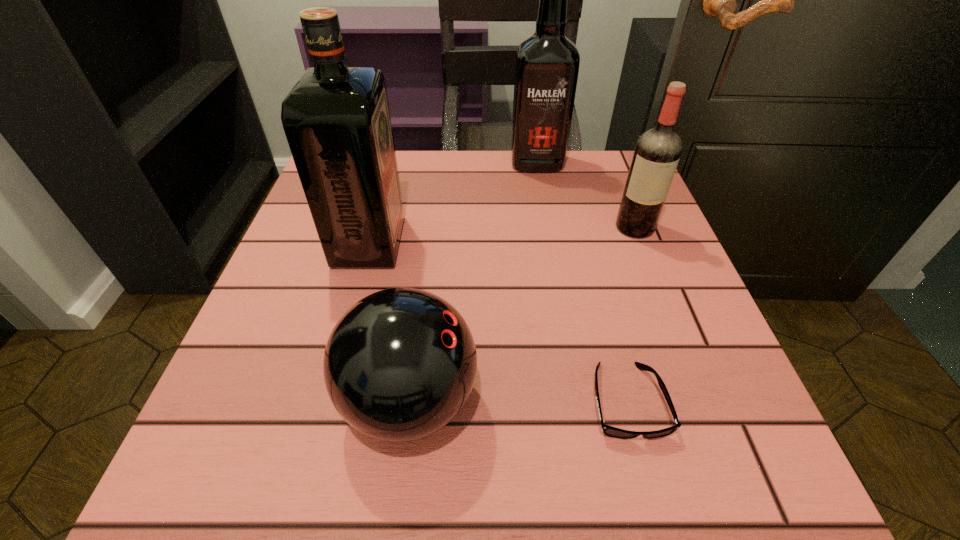
I want to click on blank space at the left edge of the desktop, so click(306, 271).

In the image, there is a desktop. At what (x,y) coordinates should I click in order to perform the action: click on vacant space at the right edge. Please return your answer as a coordinate pair (x, y). The image size is (960, 540). Looking at the image, I should click on (691, 334).

Find the location of `free space at the far right corner`. free space at the far right corner is located at coordinates (598, 200).

Locate an element on the screen. The width and height of the screenshot is (960, 540). empty location between the shortest liquor and the sunglasses is located at coordinates (631, 314).

Where is `free spot between the bowling ball and the farthest liquor`? The width and height of the screenshot is (960, 540). free spot between the bowling ball and the farthest liquor is located at coordinates (473, 282).

Locate an element on the screen. Image resolution: width=960 pixels, height=540 pixels. free space between the sunglasses and the farthest object is located at coordinates (582, 282).

This screenshot has width=960, height=540. I want to click on free space between the farthest liquor and the leftmost liquor, so [x=453, y=202].

Find the location of a particular element. This screenshot has width=960, height=540. vacant region between the rightmost object and the leftmost liquor is located at coordinates (502, 235).

Find the location of `vacant space in between the shortest object and the second shortest object`. vacant space in between the shortest object and the second shortest object is located at coordinates (518, 401).

Locate an element on the screen. This screenshot has width=960, height=540. unoccupied area between the bowling ball and the second liquor from left to right is located at coordinates (473, 282).